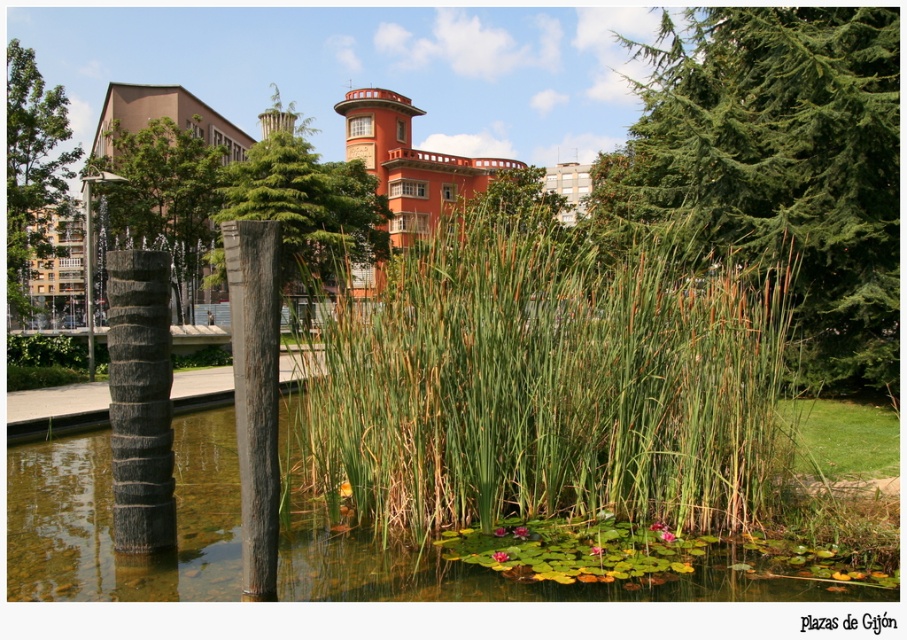
Based on the photo, which is above, green needle-like leaves at upper right or green leafy tree at upper left?

green needle-like leaves at upper right is higher up.

Does green needle-like leaves at upper right have a greater width compared to green leafy tree at upper left?

Yes, green needle-like leaves at upper right is wider than green leafy tree at upper left.

What are the coordinates of `green needle-like leaves at upper right` in the screenshot? It's located at (779, 163).

Is point (280, 170) behind point (250, 301)?

Yes, it is.

Does point (366, 244) lie behind point (226, 257)?

Yes, it is.

Image resolution: width=907 pixels, height=640 pixels. I want to click on green leafy tree at center, so click(x=305, y=204).

What do you see at coordinates (140, 400) in the screenshot? I see `dark gray textured column at left` at bounding box center [140, 400].

At what (x,y) coordinates should I click in order to perform the action: click on dark gray textured column at left. Please return your answer as a coordinate pair (x, y). This screenshot has height=640, width=907. Looking at the image, I should click on (140, 400).